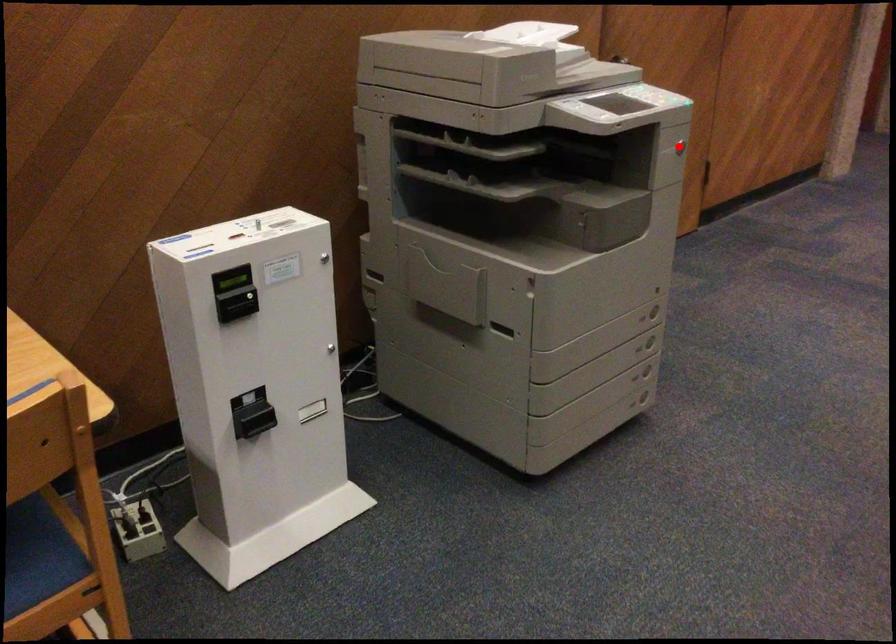
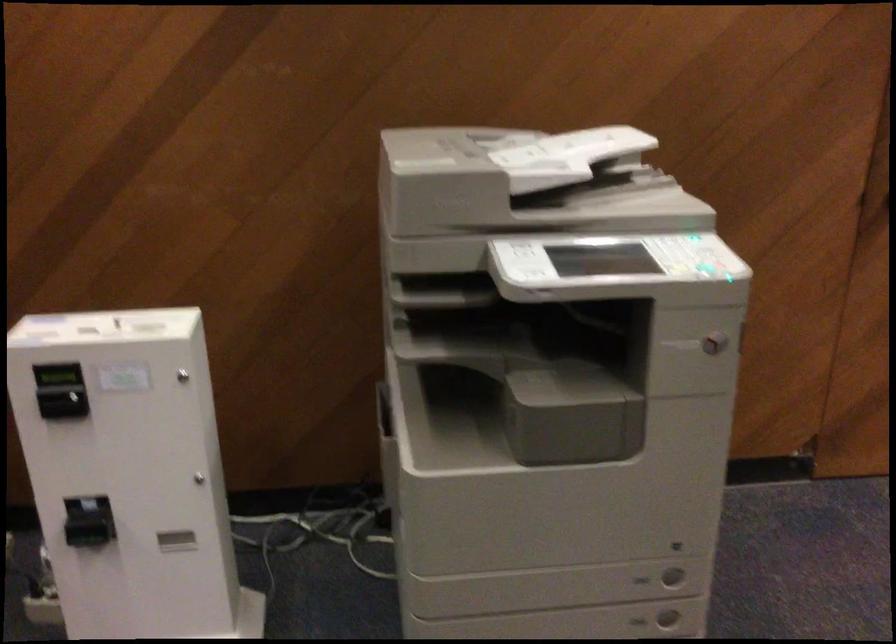
Question: I am providing you with two images of the same scene from different viewpoints. In image1, a red point is highlighted. Considering the same 3D point in image2, which of the following is correct?

Choices:
 (A) It is closer
 (B) It is farther

Answer: (A)